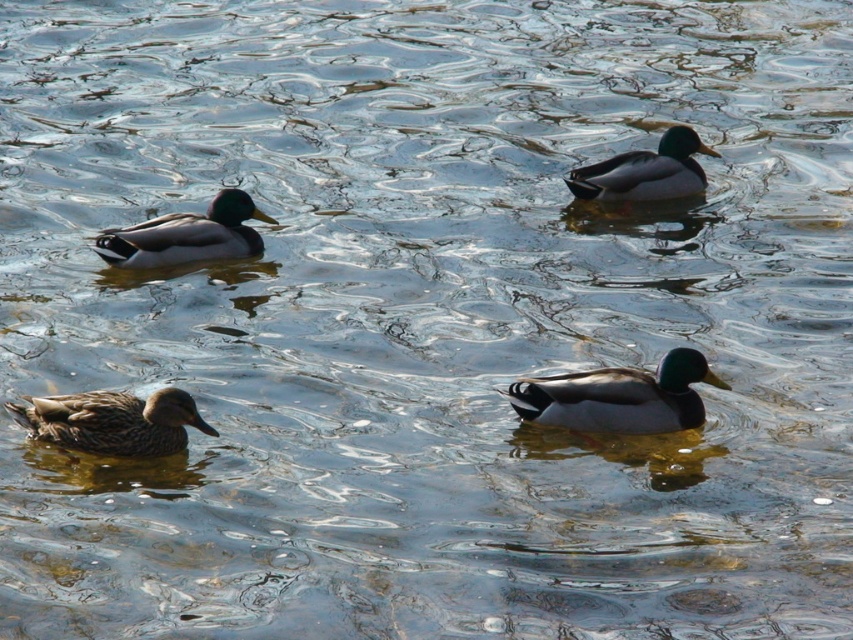
Question: Is green glossy duck at left smaller than shiny brown duck at upper right?

Choices:
 (A) yes
 (B) no

Answer: (B)

Question: Which point appears farthest from the camera in this image?

Choices:
 (A) (190, 220)
 (B) (659, 182)

Answer: (B)

Question: Is shiny brown duck at center smaller than shiny brown duck at upper right?

Choices:
 (A) yes
 (B) no

Answer: (A)

Question: Considering the real-world distances, which object is closest to the green glossy duck at left?

Choices:
 (A) shiny brown duck at upper right
 (B) brown matte duck at lower left

Answer: (A)

Question: Is brown matte duck at lower left further to the viewer compared to shiny brown duck at upper right?

Choices:
 (A) no
 (B) yes

Answer: (A)

Question: Which object is farther from the camera taking this photo?

Choices:
 (A) brown matte duck at lower left
 (B) shiny brown duck at upper right
 (C) shiny brown duck at center

Answer: (B)